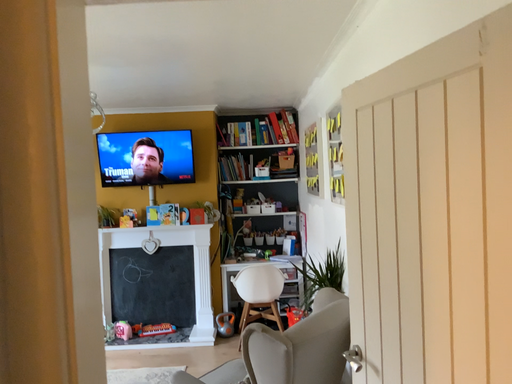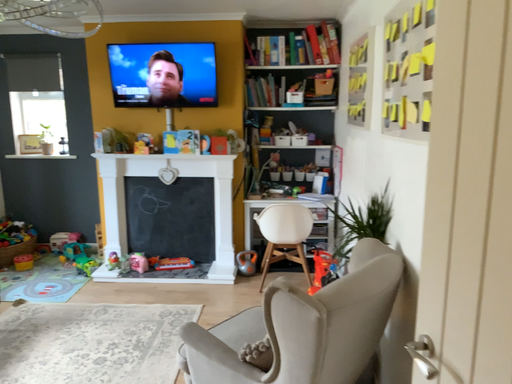
Question: How did the camera likely rotate when shooting the video?

Choices:
 (A) rotated downward
 (B) rotated upward

Answer: (A)